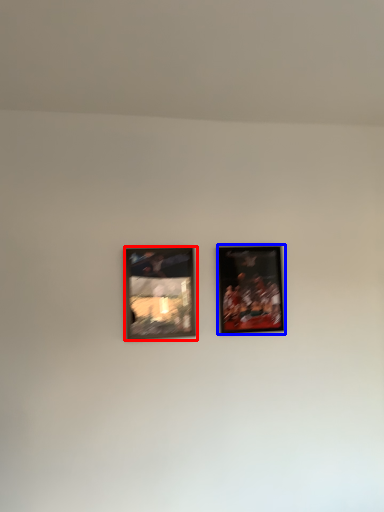
Question: Which of the following is the farthest to the observer, picture frame (highlighted by a red box) or picture frame (highlighted by a blue box)?

Choices:
 (A) picture frame
 (B) picture frame

Answer: (B)